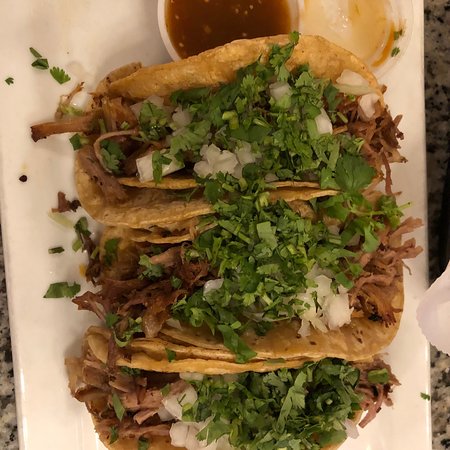
I want to click on cup lid, so click(x=358, y=37).